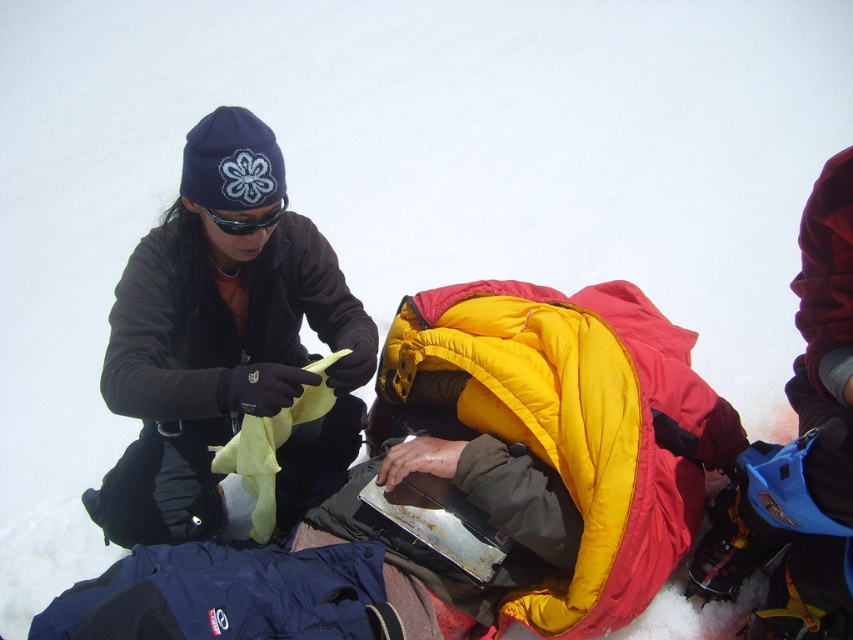
In the scene shown: Who is taller, matte black jacket at left or matte black goggles at upper center?

matte black jacket at left is taller.

Which of these two, matte black jacket at left or matte black goggles at upper center, stands shorter?

With less height is matte black goggles at upper center.

Image resolution: width=853 pixels, height=640 pixels. What do you see at coordinates (224, 342) in the screenshot? I see `matte black jacket at left` at bounding box center [224, 342].

Locate an element on the screen. This screenshot has height=640, width=853. matte black jacket at left is located at coordinates coord(224,342).